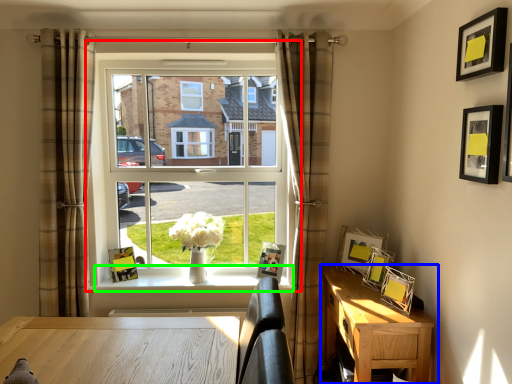
Question: Estimate the real-world distances between objects in this image. Which object is farther from window (highlighted by a red box), nightstand (highlighted by a blue box) or window sill (highlighted by a green box)?

Choices:
 (A) nightstand
 (B) window sill

Answer: (A)